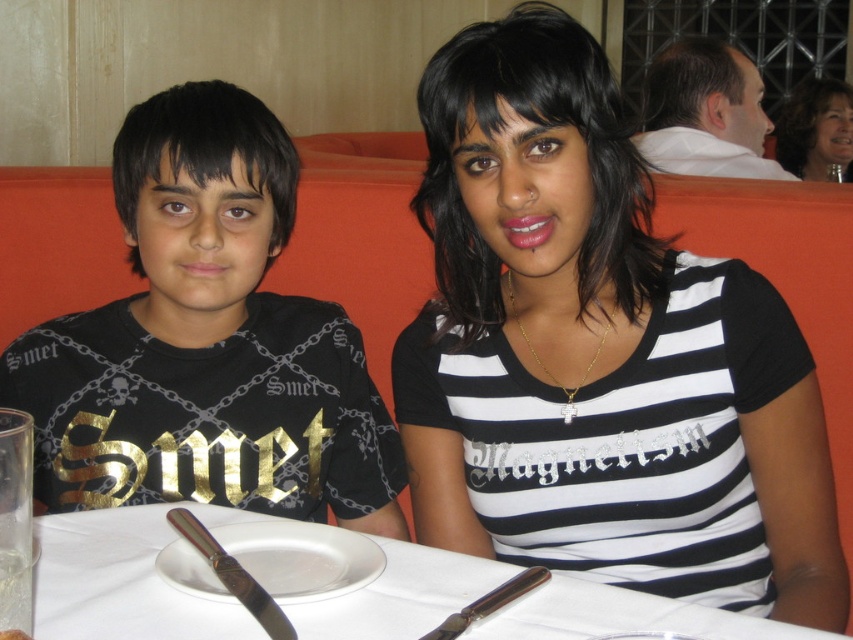
Question: Can you confirm if black and white striped shirt at center is positioned below white paper table at center?

Choices:
 (A) yes
 (B) no

Answer: (B)

Question: Which point appears closest to the camera in this image?

Choices:
 (A) (445, 632)
 (B) (245, 260)

Answer: (A)

Question: Which point is closer to the camera?

Choices:
 (A) black matte shirt at left
 (B) white paper table at center

Answer: (B)

Question: Does polished metal knife at lower left come behind shiny metallic knife at lower center?

Choices:
 (A) yes
 (B) no

Answer: (A)

Question: Does matte black hair at upper right have a greater width compared to shiny metallic knife at lower center?

Choices:
 (A) no
 (B) yes

Answer: (B)

Question: Which point is closer to the camera?

Choices:
 (A) (268, 632)
 (B) (578, 609)
 (C) (535, 573)

Answer: (A)